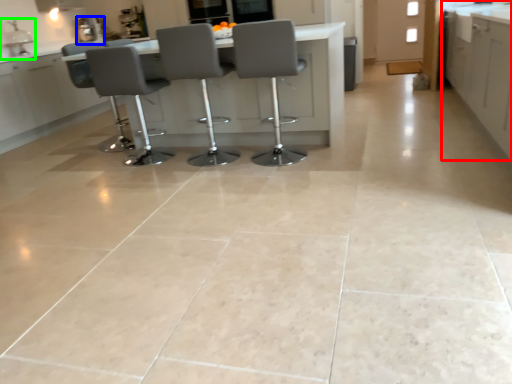
Question: Which is farther away from cabinetry (highlighted by a red box)? appliance (highlighted by a blue box) or sink (highlighted by a green box)?

Choices:
 (A) appliance
 (B) sink

Answer: (B)